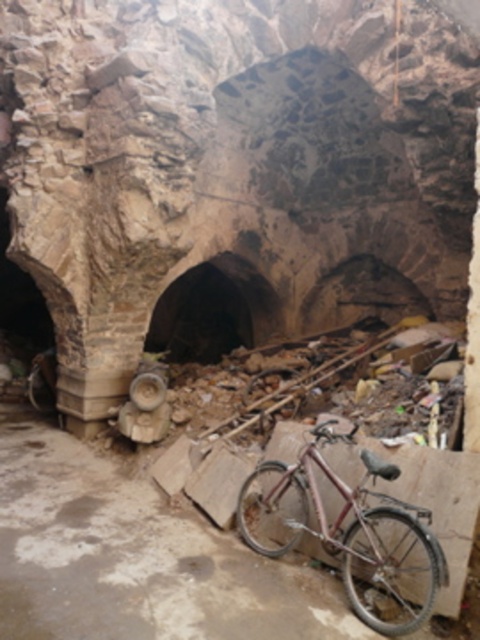
Question: Can you confirm if rusty metallic bicycle at center is positioned to the right of brown stone tunnel at center?

Choices:
 (A) yes
 (B) no

Answer: (A)

Question: Which of the following is the closest to the observer?

Choices:
 (A) brown stone tunnel at center
 (B) rusty metal bicycle at center

Answer: (B)

Question: Which object appears closest to the camera in this image?

Choices:
 (A) rusty metallic bicycle at center
 (B) brown stone tunnel at center
 (C) rusty metal bicycle at center

Answer: (C)

Question: Can you confirm if rusty metal bicycle at center is smaller than brown stone tunnel at center?

Choices:
 (A) no
 (B) yes

Answer: (B)

Question: Which point is closer to the camera taking this photo?

Choices:
 (A) (267, 301)
 (B) (308, 464)
 (C) (176, 513)

Answer: (B)

Question: Does rusty metal bicycle at center have a lesser width compared to rusty metallic bicycle at center?

Choices:
 (A) no
 (B) yes

Answer: (A)